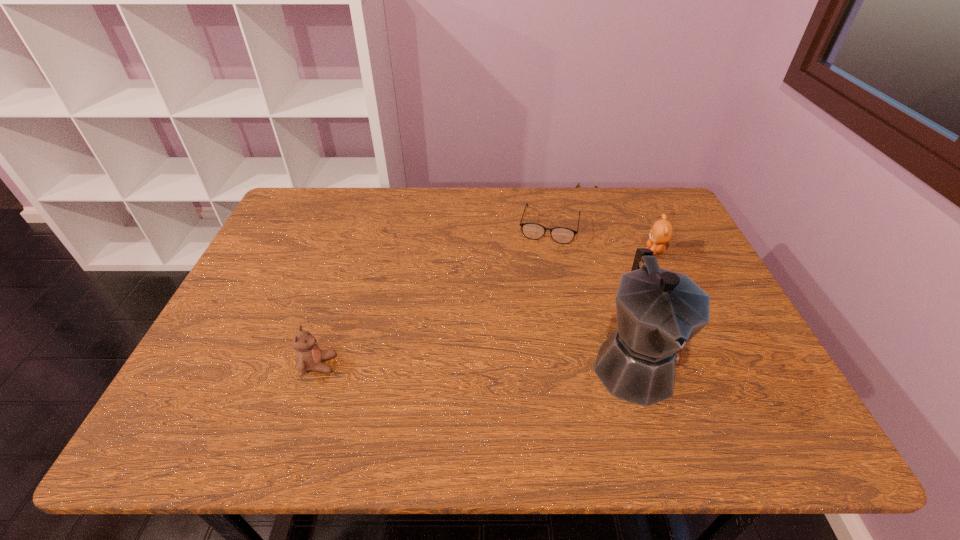
You are a GUI agent. You are given a task and a screenshot of the screen. Output one action in this format:
    pyautogui.click(x=<x>, y=<y>)
    Task: Click on the blank space at the right edge
    
    Given the screenshot: What is the action you would take?
    pyautogui.click(x=672, y=256)

Find the location of a particular element. vacant area at the far left corner of the desktop is located at coordinates (321, 213).

The image size is (960, 540). I want to click on vacant space at the near right corner of the desktop, so click(x=768, y=369).

Find the location of a particular element. The width and height of the screenshot is (960, 540). free area in between the farther teddy bear and the shortest object is located at coordinates (603, 238).

You are a GUI agent. You are given a task and a screenshot of the screen. Output one action in this format:
    pyautogui.click(x=<x>, y=<y>)
    Task: Click on the free space between the coffeepot and the shortest object
    
    Given the screenshot: What is the action you would take?
    (591, 295)

You are a GUI agent. You are given a task and a screenshot of the screen. Output one action in this format:
    pyautogui.click(x=<x>, y=<y>)
    Task: Click on the vacant point located between the rightmost object and the nearer teddy bear
    
    Given the screenshot: What is the action you would take?
    pyautogui.click(x=487, y=308)

Locate an element on the screen. free space between the coffeepot and the leftmost object is located at coordinates (476, 364).

You are a GUI agent. You are given a task and a screenshot of the screen. Output one action in this format:
    pyautogui.click(x=<x>, y=<y>)
    Task: Click on the vacant space that's between the nearer teddy bear and the spectacles
    The height and width of the screenshot is (540, 960).
    Given the screenshot: What is the action you would take?
    pyautogui.click(x=434, y=295)

This screenshot has height=540, width=960. I want to click on free space between the spectacles and the rightmost object, so click(x=603, y=238).

At what (x,y) coordinates should I click in order to perform the action: click on vacant space that is in between the right teddy bear and the leftmost object. Please return your answer as a coordinate pair (x, y). Looking at the image, I should click on (487, 308).